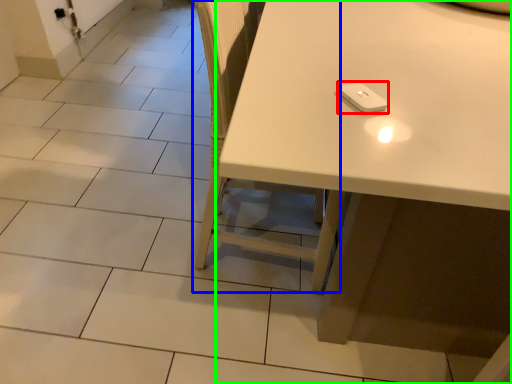
Question: Considering the real-world distances, which object is farthest from Wii controller (highlighted by a red box)? chair (highlighted by a blue box) or table (highlighted by a green box)?

Choices:
 (A) chair
 (B) table

Answer: (A)